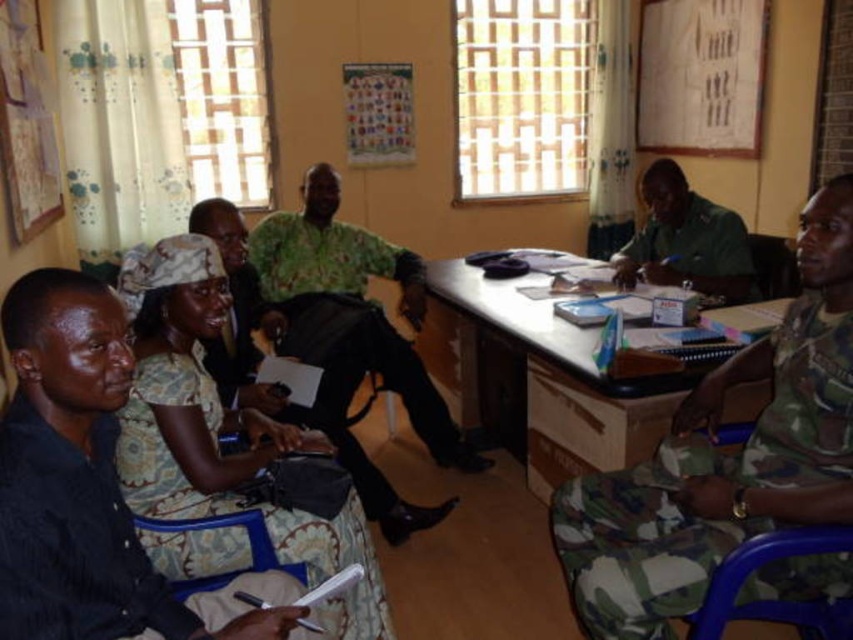
Question: Which object is positioned closest to the wooden desk at center?

Choices:
 (A) green camouflage uniform at center
 (B) blue fabric chair at lower left
 (C) blue plastic chair at lower right
 (D) black matte shirt at lower left

Answer: (A)

Question: Considering the relative positions of wooden desk at center and blue fabric chair at lower left in the image provided, where is wooden desk at center located with respect to blue fabric chair at lower left?

Choices:
 (A) above
 (B) below

Answer: (A)

Question: Which of the following is the closest to the observer?

Choices:
 (A) green camouflage uniform at center
 (B) blue fabric chair at lower left
 (C) camouflage shirt at center

Answer: (B)

Question: Considering the real-world distances, which object is farthest from the black matte shirt at lower left?

Choices:
 (A) green camouflage uniform at center
 (B) camouflage shirt at center
 (C) blue fabric chair at lower left

Answer: (A)

Question: Does black matte shirt at lower left appear on the right side of wooden desk at center?

Choices:
 (A) no
 (B) yes

Answer: (A)

Question: Can you confirm if wooden desk at center is thinner than green camouflage uniform at center?

Choices:
 (A) no
 (B) yes

Answer: (A)